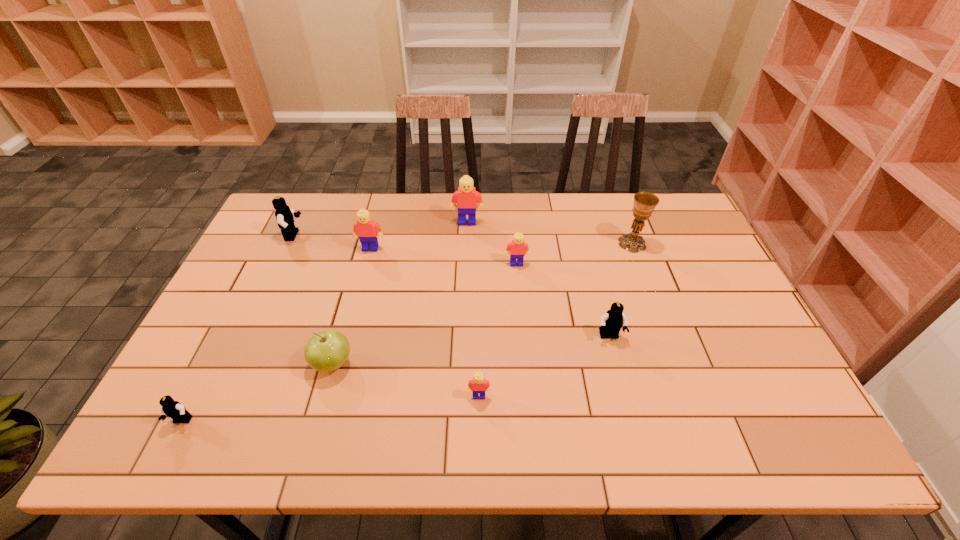
This screenshot has width=960, height=540. Find the location of `the farthest object`. the farthest object is located at coordinates (466, 197).

Where is `the biggest yellow Lego`? the biggest yellow Lego is located at coordinates (466, 197).

Identify the location of the rightmost object. The width and height of the screenshot is (960, 540). pos(644,202).

What are the coordinates of `gold chalice` in the screenshot? It's located at click(x=644, y=202).

Identify the location of the eighth object from right to left. The height and width of the screenshot is (540, 960). (284, 215).

The width and height of the screenshot is (960, 540). Find the location of `the farthest black Lego`. the farthest black Lego is located at coordinates (284, 215).

This screenshot has width=960, height=540. Identify the location of the third Lego from left to right. (365, 228).

This screenshot has width=960, height=540. Identify the location of the third smallest yellow Lego. (365, 228).

Where is `the third farthest yellow Lego`? This screenshot has width=960, height=540. the third farthest yellow Lego is located at coordinates point(518,248).

This screenshot has width=960, height=540. I want to click on the sixth Lego from left to right, so click(518, 248).